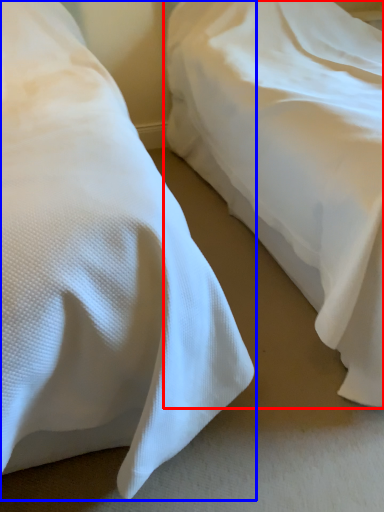
Question: Which of the following is the closest to the observer, bed (highlighted by a red box) or bed (highlighted by a blue box)?

Choices:
 (A) bed
 (B) bed

Answer: (B)